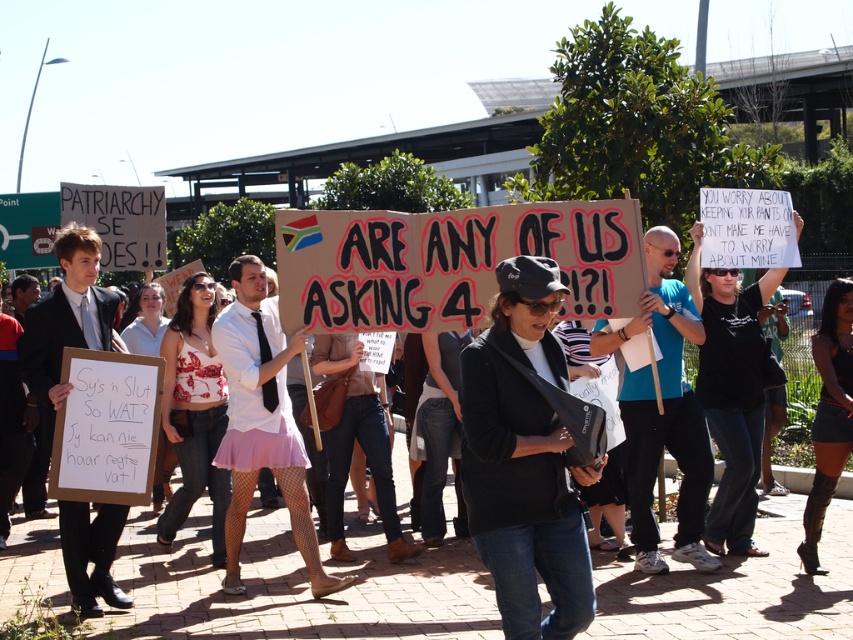
Can you confirm if blue t-shirt at center is positioned below black fabric shirt at center?

Yes, blue t-shirt at center is below black fabric shirt at center.

Can you confirm if blue t-shirt at center is bigger than black fabric shirt at center?

Yes, blue t-shirt at center is bigger than black fabric shirt at center.

Does point (677, 444) lie behind point (718, 541)?

No, (677, 444) is in front of (718, 541).

At what (x,y) coordinates should I click in order to perform the action: click on blue t-shirt at center. Please return your answer as a coordinate pair (x, y). The image size is (853, 640). Looking at the image, I should click on (662, 412).

Locate an element on the screen. The height and width of the screenshot is (640, 853). black matte jacket at center is located at coordinates (523, 460).

Is point (544, 294) in front of point (679, 465)?

Yes, point (544, 294) is closer to viewer.

This screenshot has height=640, width=853. What do you see at coordinates (523, 460) in the screenshot? I see `black matte jacket at center` at bounding box center [523, 460].

At what (x,y) coordinates should I click in order to perform the action: click on black matte jacket at center. Please return your answer as a coordinate pair (x, y). The height and width of the screenshot is (640, 853). Looking at the image, I should click on (523, 460).

From the picture: Does black matte jacket at center have a smaller size compared to black fabric shirt at center?

Yes, black matte jacket at center is smaller than black fabric shirt at center.

Does black matte jacket at center appear under black fabric shirt at center?

Yes.

Locate an element on the screen. This screenshot has height=640, width=853. black matte jacket at center is located at coordinates (523, 460).

At what (x,y) coordinates should I click in order to perform the action: click on black matte jacket at center. Please return your answer as a coordinate pair (x, y). This screenshot has width=853, height=640. Looking at the image, I should click on (523, 460).